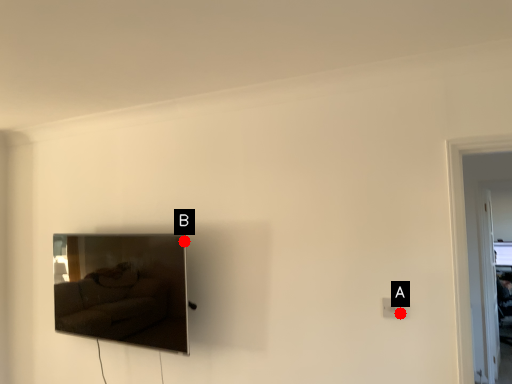
Question: Two points are circled on the image, labeled by A and B beside each circle. Which point is farther from the camera taking this photo?

Choices:
 (A) A is further
 (B) B is further

Answer: (B)